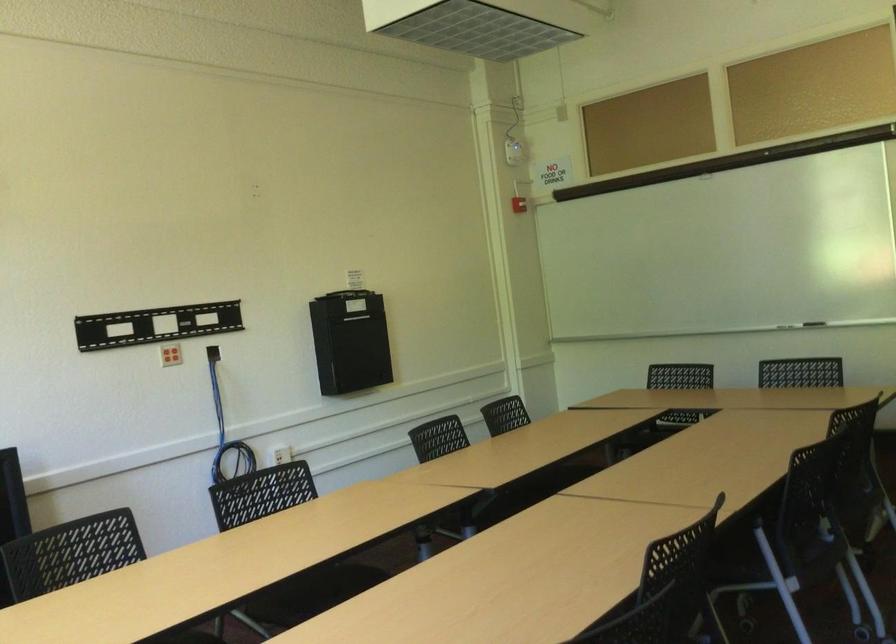
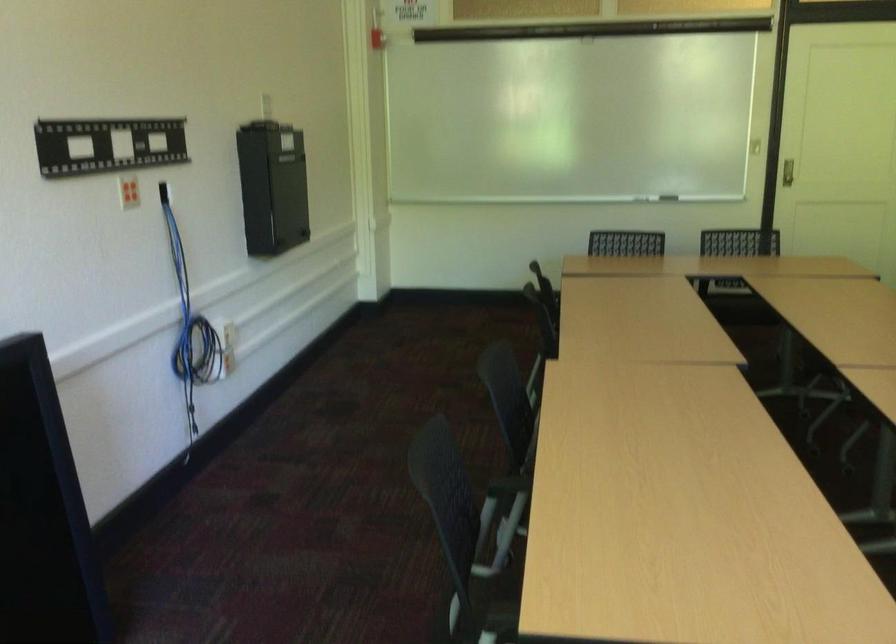
Question: I am providing you with two images of the same scene from different viewpoints. Which of the following objects are not visible in image2?

Choices:
 (A) black chair armrest
 (B) recessed door handle
 (C) whiteboard eraser
 (D) none of these

Answer: (D)